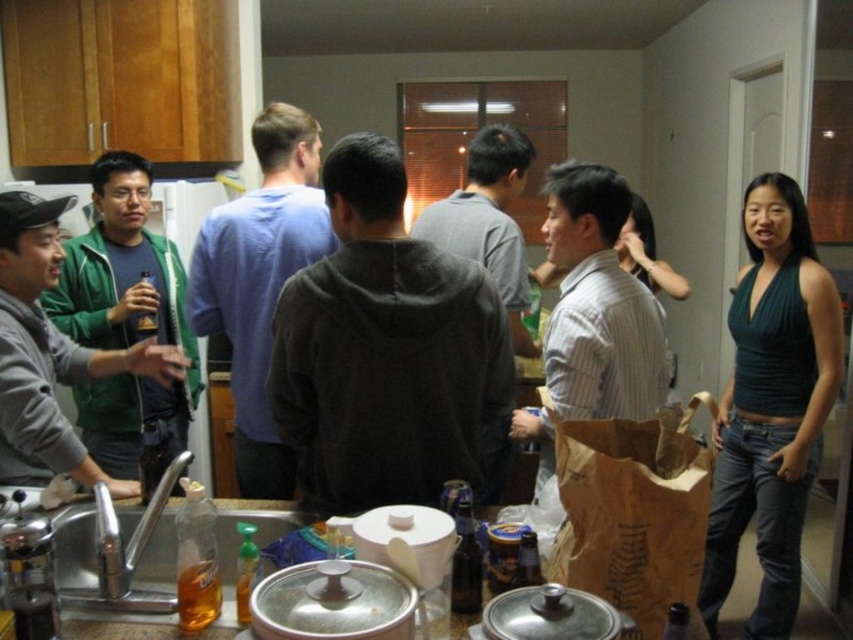
Question: Which object is farther from the camera taking this photo?

Choices:
 (A) dark gray hoodie at center
 (B) brown paper bag at center

Answer: (A)

Question: Is dark gray hoodie at center above translucent glass bottle at center?

Choices:
 (A) yes
 (B) no

Answer: (A)

Question: Is green matte jacket at left bigger than striped cotton shirt at center?

Choices:
 (A) no
 (B) yes

Answer: (A)

Question: Does blue cotton shirt at center appear on the left side of translucent plastic beer bottle at left?

Choices:
 (A) no
 (B) yes

Answer: (A)

Question: Based on their relative distances, which object is farther from the blue cotton shirt at center?

Choices:
 (A) brown paper bag at center
 (B) green matte jacket at left
 (C) striped cotton shirt at center

Answer: (A)

Question: Which object is closer to the camera taking this photo?

Choices:
 (A) blue cotton shirt at center
 (B) dark gray hoodie at center
 (C) translucent glass bottle at center
 (D) green matte jacket at left

Answer: (C)